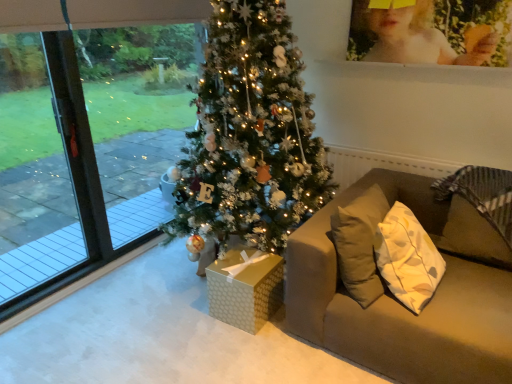
Question: Can you confirm if matte brown couch at right is thinner than transparent glass window at left?

Choices:
 (A) no
 (B) yes

Answer: (A)

Question: Is matte brown couch at right to the right of transparent glass window at left from the viewer's perspective?

Choices:
 (A) yes
 (B) no

Answer: (A)

Question: Is matte brown couch at right closer to the viewer compared to transparent glass window at left?

Choices:
 (A) yes
 (B) no

Answer: (A)

Question: Can you confirm if matte brown couch at right is shorter than transparent glass window at left?

Choices:
 (A) no
 (B) yes

Answer: (B)

Question: Considering the relative positions of matte brown couch at right and transparent glass window at left in the image provided, is matte brown couch at right behind transparent glass window at left?

Choices:
 (A) no
 (B) yes

Answer: (A)

Question: From a real-world perspective, is matte brown couch at right physically located above or below matte yellow photo frame at upper right?

Choices:
 (A) above
 (B) below

Answer: (B)

Question: Relative to matte yellow photo frame at upper right, is matte brown couch at right in front or behind?

Choices:
 (A) front
 (B) behind

Answer: (A)

Question: Choose the correct answer: Is matte brown couch at right inside matte yellow photo frame at upper right or outside it?

Choices:
 (A) inside
 (B) outside

Answer: (B)

Question: Is matte brown couch at right taller or shorter than matte yellow photo frame at upper right?

Choices:
 (A) tall
 (B) short

Answer: (A)

Question: Looking at their shapes, would you say transparent glass window at left is wider or thinner than matte brown couch at right?

Choices:
 (A) thin
 (B) wide

Answer: (A)

Question: From their relative heights in the image, would you say transparent glass window at left is taller or shorter than matte brown couch at right?

Choices:
 (A) short
 (B) tall

Answer: (B)

Question: Is point (84, 0) closer or farther from the camera than point (374, 360)?

Choices:
 (A) farther
 (B) closer

Answer: (A)

Question: Considering the positions of transparent glass window at left and matte brown couch at right in the image, is transparent glass window at left bigger or smaller than matte brown couch at right?

Choices:
 (A) small
 (B) big

Answer: (A)

Question: Is point (30, 178) positioned closer to the camera than point (272, 292)?

Choices:
 (A) closer
 (B) farther

Answer: (B)

Question: Is transparent glass screen door at left spatially inside gold textured gift box at center, or outside of it?

Choices:
 (A) inside
 (B) outside

Answer: (B)